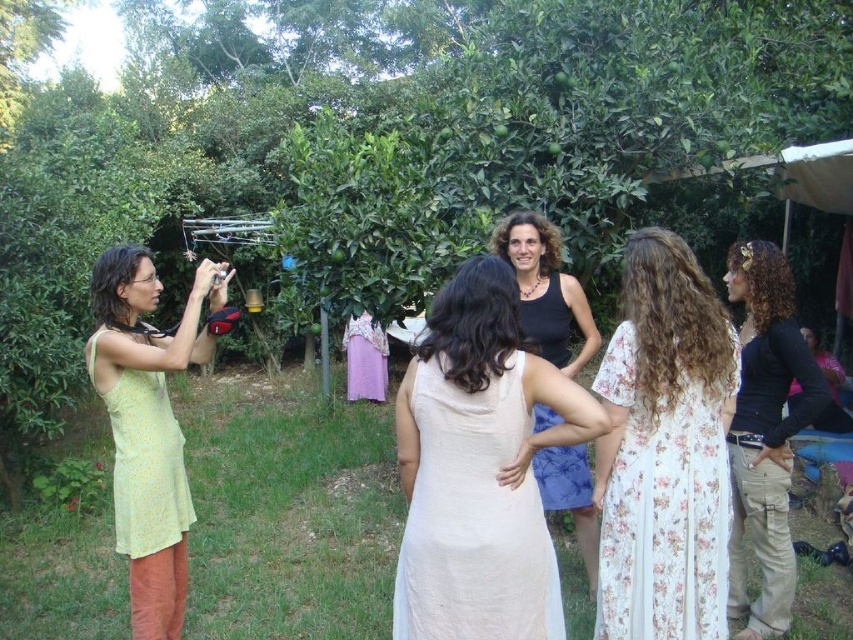
You are standing in the garden and want to take a photo of the black matte tank top at center and the yellow floral fabric dress at left. Based on their positions, which one should you focus on first to ensure both are in frame?

You should focus on the yellow floral fabric dress at left first because the black matte tank top at center is to the right of it, so by centering the dress first, you can adjust the camera to include both in the frame.

You are a photographer standing 1 meter away from the group. You want to capture both the black matte tank top at center and the light beige fabric dress at center in the same frame. Can you fit both into your camera view without moving closer or further away?

The black matte tank top at center is 35.11 centimeters away from the light beige fabric dress at center. Since the distance between them is less than 1 meter, you can fit both into the camera view without moving closer or further away.